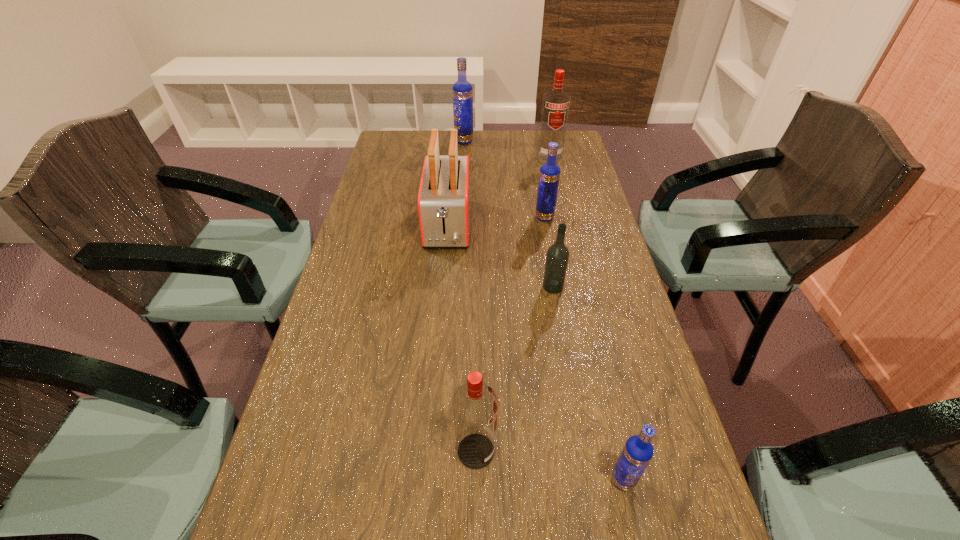
Where is `the fifth farthest object`? the fifth farthest object is located at coordinates (557, 257).

I want to click on the smallest blue vodka, so click(x=638, y=451).

The height and width of the screenshot is (540, 960). Identify the location of the rightmost blue vodka. (638, 451).

The height and width of the screenshot is (540, 960). I want to click on vacant point located 0.090m on the front of the leftmost blue vodka, so (x=463, y=158).

Locate an element on the screen. Image resolution: width=960 pixels, height=540 pixels. free space located 0.400m on the front label of the right red vodka is located at coordinates (567, 231).

Where is `vacant space positioned on the front-facing side of the red toaster`? vacant space positioned on the front-facing side of the red toaster is located at coordinates (444, 278).

Image resolution: width=960 pixels, height=540 pixels. I want to click on free space located 0.200m on the left of the second blue vodka from right to left, so click(469, 217).

At what (x,y) coordinates should I click in order to perform the action: click on free region located on the front label of the left red vodka. Please return your answer as a coordinate pair (x, y). The image size is (960, 540). Looking at the image, I should click on (523, 451).

The width and height of the screenshot is (960, 540). Identify the location of vacant position located 0.280m on the back of the fourth farthest vodka. (541, 215).

The width and height of the screenshot is (960, 540). I want to click on free space located 0.360m on the back of the rightmost blue vodka, so click(x=586, y=316).